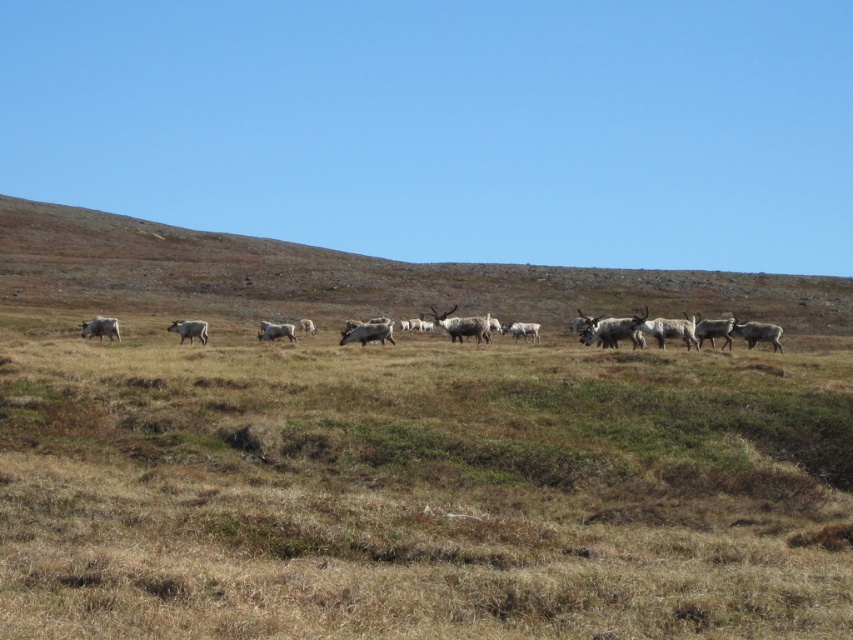
Who is positioned more to the right, brown dry grass at center or brown grassland at center?

From the viewer's perspective, brown grassland at center appears more on the right side.

Who is shorter, brown dry grass at center or brown grassland at center?

With less height is brown dry grass at center.

Does point (525, 458) come in front of point (128, 298)?

Yes, point (525, 458) is closer to viewer.

At what (x,y) coordinates should I click in order to perform the action: click on brown dry grass at center. Please return your answer as a coordinate pair (x, y). The image size is (853, 640). Looking at the image, I should click on (418, 486).

In the scene shown: Does brown dry grass at center come behind white fur reindeer at center?

No, it is not.

In the scene shown: Which is below, brown dry grass at center or white fur reindeer at center?

brown dry grass at center is below.

Does point (222, 493) come closer to viewer compared to point (196, 332)?

Yes, point (222, 493) is in front of point (196, 332).

This screenshot has width=853, height=640. In order to click on brown dry grass at center in this screenshot , I will do coord(418,486).

Can you confirm if gray matte reindeer at center is wider than white fur reindeer at center?

Indeed, gray matte reindeer at center has a greater width compared to white fur reindeer at center.

Who is more forward, (589, 324) or (183, 336)?

Point (589, 324) is more forward.

In order to click on gray matte reindeer at center in this screenshot , I will do point(676,330).